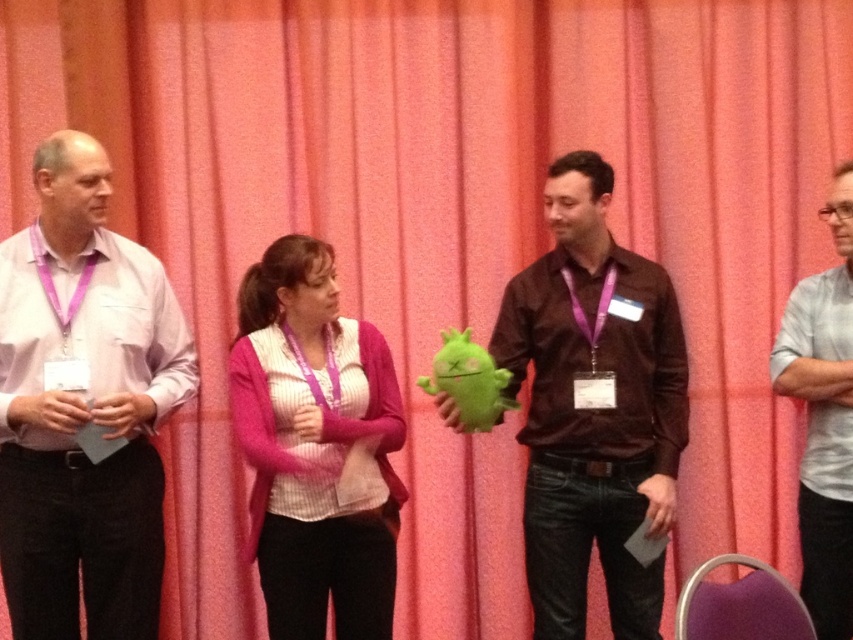
Where is `matte pink shirt at left`? The width and height of the screenshot is (853, 640). matte pink shirt at left is located at coordinates (83, 406).

Can you confirm if matte pink shirt at left is positioned above pink fuzzy sweater at center?

Indeed, matte pink shirt at left is positioned over pink fuzzy sweater at center.

Identify the location of matte pink shirt at left. pos(83,406).

Where is `matte pink shirt at left`? matte pink shirt at left is located at coordinates (83, 406).

What do you see at coordinates (593, 406) in the screenshot? I see `matte brown shirt at center` at bounding box center [593, 406].

Does matte brown shirt at center have a greater height compared to pink fuzzy sweater at center?

Correct, matte brown shirt at center is much taller as pink fuzzy sweater at center.

Does point (576, 513) come closer to viewer compared to point (352, 563)?

No, (576, 513) is behind (352, 563).

You are a GUI agent. You are given a task and a screenshot of the screen. Output one action in this format:
    pyautogui.click(x=<x>, y=<y>)
    Task: Click on the matte brown shirt at center
    This screenshot has height=640, width=853.
    Given the screenshot: What is the action you would take?
    pyautogui.click(x=593, y=406)

Does point (142, 266) come in front of point (630, 340)?

Yes, it is.

Who is shorter, matte pink shirt at left or matte brown shirt at center?

Standing shorter between the two is matte pink shirt at left.

Is point (22, 467) more distant than point (608, 547)?

No, it is not.

You are a GUI agent. You are given a task and a screenshot of the screen. Output one action in this format:
    pyautogui.click(x=<x>, y=<y>)
    Task: Click on the matte pink shirt at left
    The image size is (853, 640).
    Given the screenshot: What is the action you would take?
    pyautogui.click(x=83, y=406)